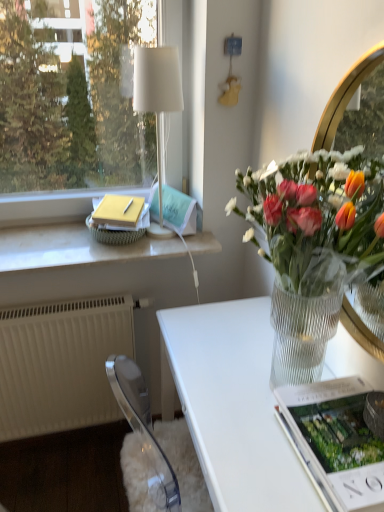
Question: Is clear gold mirror at upper right in front of or behind white plastic radiator at lower left in the image?

Choices:
 (A) behind
 (B) front

Answer: (B)

Question: From the image's perspective, is clear gold mirror at upper right positioned above or below white plastic radiator at lower left?

Choices:
 (A) below
 (B) above

Answer: (B)

Question: Which object is the closest to the white fabric lampshade at upper left?

Choices:
 (A) clear gold mirror at upper right
 (B) clear glass vase at right
 (C) white marble window sill at upper left
 (D) white glossy desk at center
 (E) matte white magazine at lower right, which appears as the 2th magazine when viewed from the back

Answer: (C)

Question: Which is farther from the white plastic radiator at lower left?

Choices:
 (A) clear glass vase at right
 (B) matte white magazine at lower right, the 2th magazine in the top-to-bottom sequence
 (C) matte green magazine at upper center, which is the 1th magazine from top to bottom
 (D) white glossy desk at center
 (E) white fabric lampshade at upper left

Answer: (B)